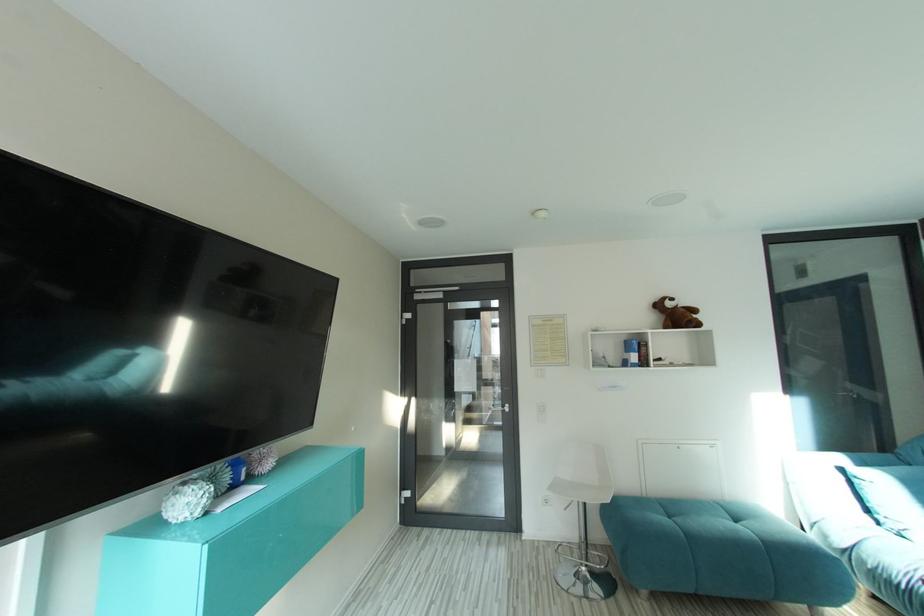
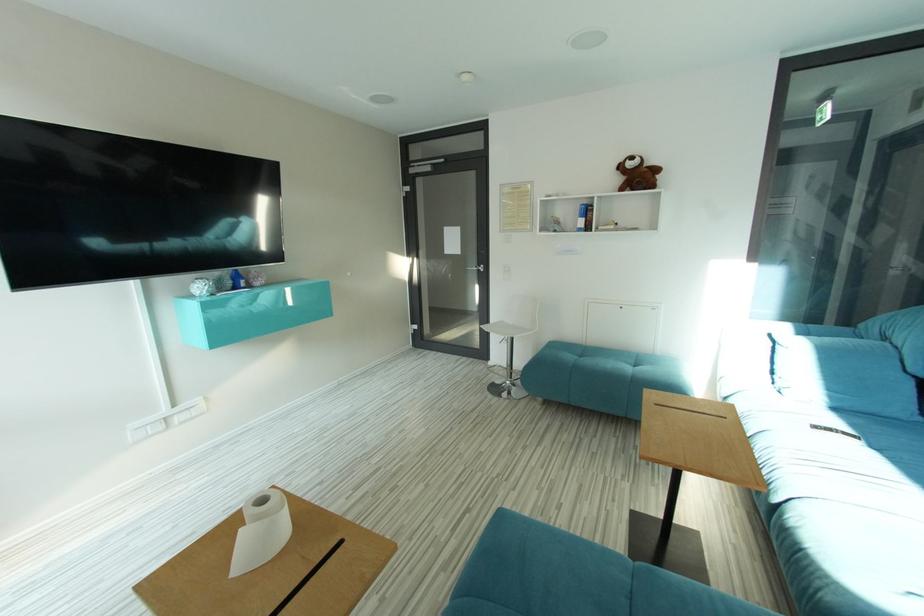
Question: Which direction would the cameraman need to move to produce the second image? Reply with the corresponding letter.

Choices:
 (A) Left
 (B) Right
 (C) Forward
 (D) Backward

Answer: (B)